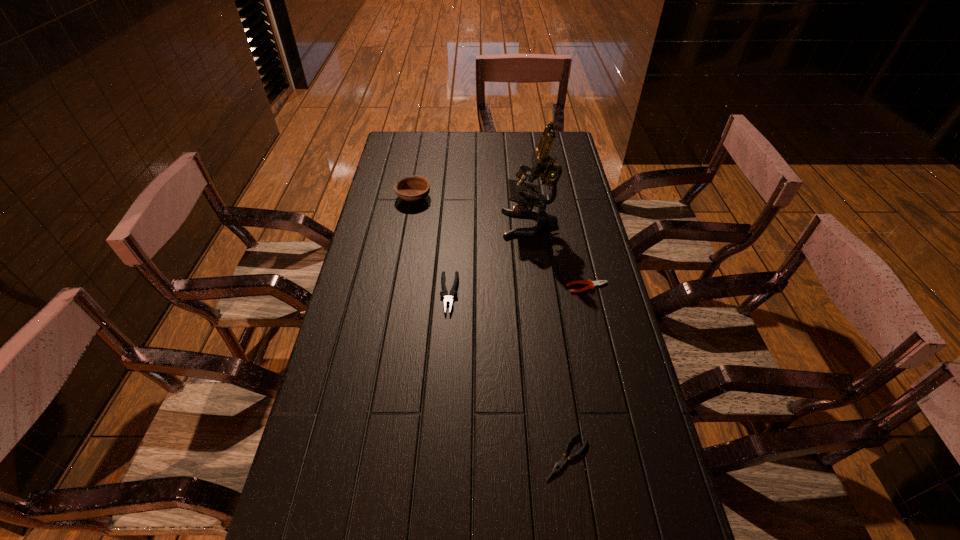
You are a GUI agent. You are given a task and a screenshot of the screen. Output one action in this format:
    pyautogui.click(x=<x>, y=<y>)
    Task: Click on the vacant space that satisfies the following two spatial constraints: 1. at the eyepieces of the second farthest object; 2. on the left side of the rightmost pliers
    The height and width of the screenshot is (540, 960).
    Given the screenshot: What is the action you would take?
    pyautogui.click(x=538, y=287)